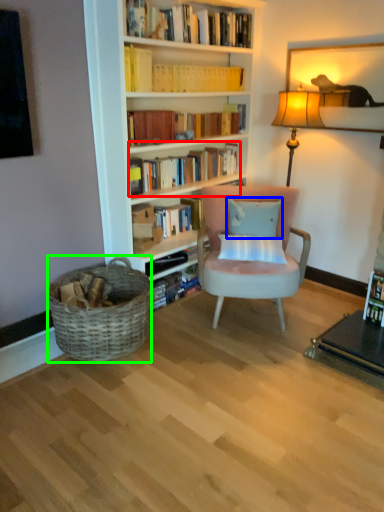
Question: Which object is positioned farthest from book (highlighted by a red box)? Select from pillow (highlighted by a blue box) and picnic basket (highlighted by a green box).

Choices:
 (A) pillow
 (B) picnic basket

Answer: (B)